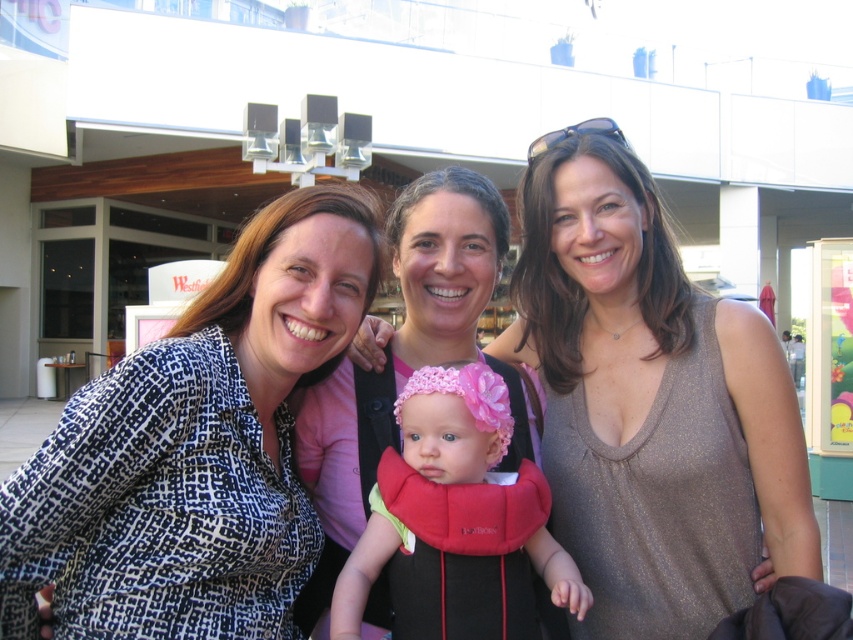
Question: Is printed fabric shirt at center above pink knitted hat at center?

Choices:
 (A) no
 (B) yes

Answer: (B)

Question: Which point is closer to the camera?

Choices:
 (A) (73, 593)
 (B) (640, 403)
 (C) (341, 632)
 (D) (457, 276)

Answer: (A)

Question: Can you confirm if shiny gold tank top at center is smaller than pink knitted hat at center?

Choices:
 (A) no
 (B) yes

Answer: (A)

Question: Based on their relative distances, which object is farther from the pink knitted hat at center?

Choices:
 (A) shiny gold tank top at center
 (B) printed fabric shirt at center

Answer: (A)

Question: Is printed fabric shirt at center bigger than pink fabric baby carrier at center?

Choices:
 (A) yes
 (B) no

Answer: (A)

Question: Which of these objects is positioned farthest from the shiny gold tank top at center?

Choices:
 (A) pink fabric baby carrier at center
 (B) pink knitted hat at center
 (C) printed fabric shirt at center

Answer: (C)